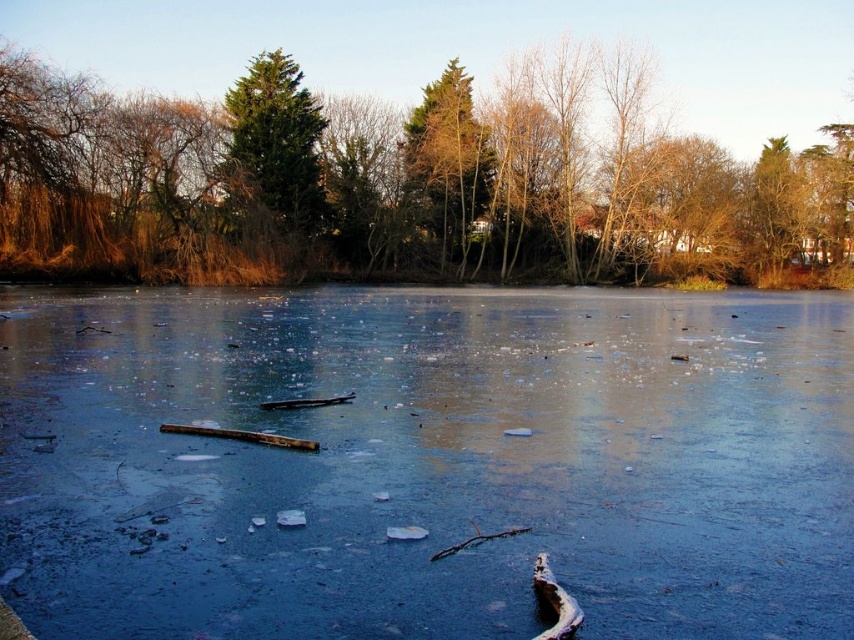
You are planning to walk across the translucent ice at center and need to avoid the green matte tree at center. Which one is wider so you can plan your path accordingly?

The translucent ice at center is wider than the green matte tree at center, so you should plan your path around the wider ice area to avoid the narrower tree.

You are an ice skater planning to glide across the translucent ice at center and the green matte tree at center. Which surface would be safer for skating, considering their sizes?

The translucent ice at center has a larger size compared to the green matte tree at center, so it would be safer for skating as larger ice patches generally provide more stable footing.